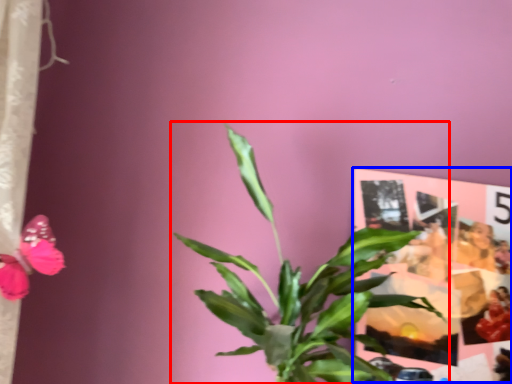
Question: Which object appears farthest to the camera in this image, houseplant (highlighted by a red box) or postcard (highlighted by a blue box)?

Choices:
 (A) houseplant
 (B) postcard

Answer: (B)